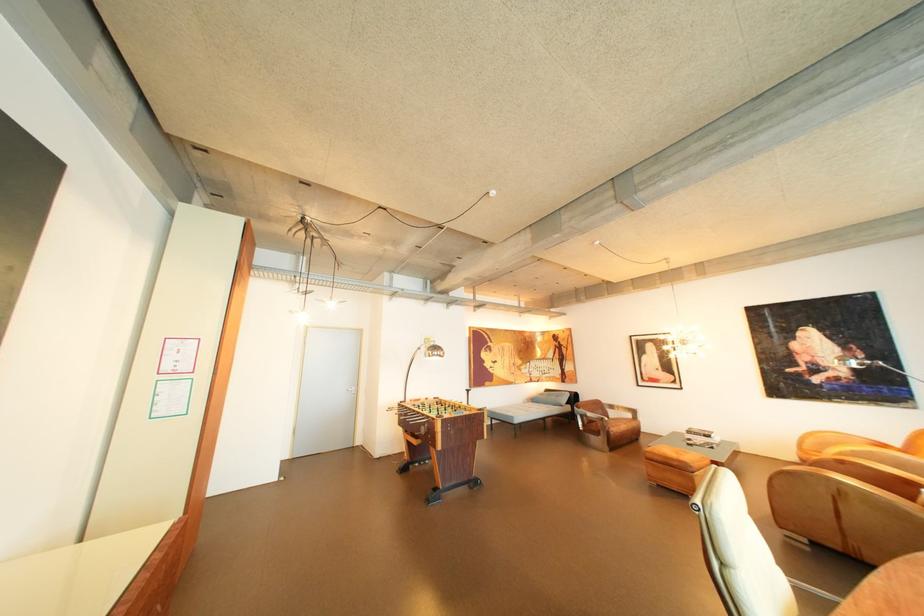
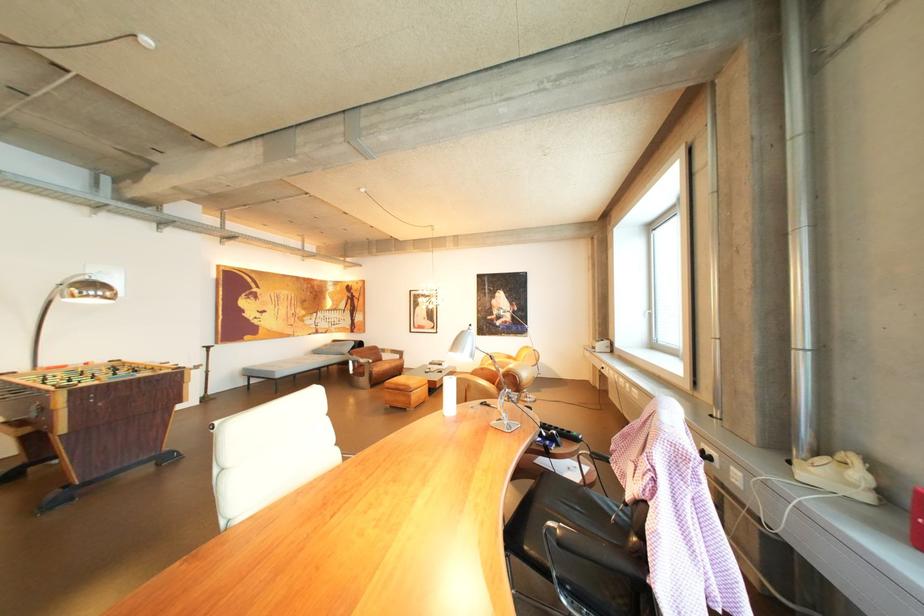
Question: The camera is either moving clockwise (left) or counter-clockwise (right) around the object. The first image is from the beginning of the video and the second image is from the end. Is the camera moving left or right when shooting the video?

Choices:
 (A) Left
 (B) Right

Answer: (A)